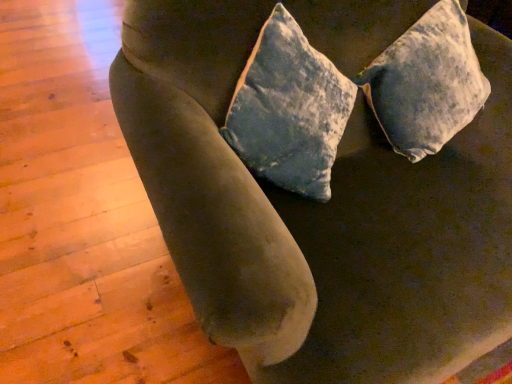
Measure the distance between point (452,94) and camera.

1.28 meters.

Image resolution: width=512 pixels, height=384 pixels. I want to click on blue velvet pillow at upper center, so click(x=426, y=83).

What do you see at coordinates (426, 83) in the screenshot? I see `blue velvet pillow at upper center` at bounding box center [426, 83].

Locate an element on the screen. blue velvet pillow at upper center is located at coordinates (426, 83).